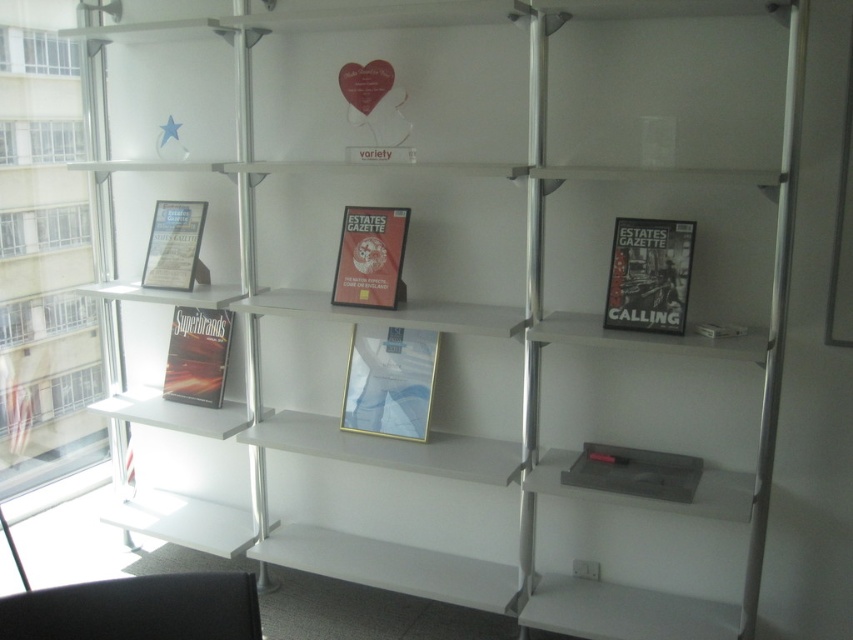
You are organizing a shelf in the room with the multi tiered shelving unit. You need to place a new item between the matte gold frame at center and the matte black book at left. Based on their current positions, where should you place the new item to maintain the existing arrangement?

The matte gold frame at center is positioned under the matte black book at left, so to maintain the existing arrangement, place the new item between them such that it is also under the matte black book at left and above the matte gold frame at center.

You are an interior designer arranging items on a shelf. You have a matte gold frame at center that needs to be placed at point [389,381]. Is there enough space at that location to place the frame?

The matte gold frame at center is located at point [389,381], so there is enough space to place the frame there.

You are organizing a display in the room and need to place a new item between the matte gold frame at center and the matte black magazine at left. Based on their positions, where should you position the new item relative to the existing items?

The matte gold frame at center is to the right of the matte black magazine at left, so you should place the new item between them by positioning it to the right of the matte black magazine at left and to the left of the matte gold frame at center.